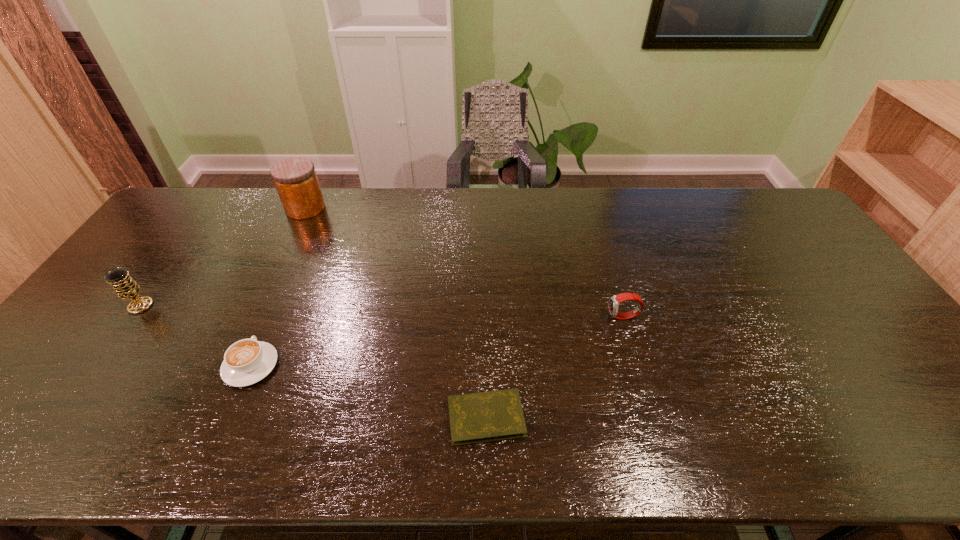
This screenshot has width=960, height=540. Identify the location of free space located on the right of the jar. (432, 208).

Locate an element on the screen. free region located on the right of the leftmost object is located at coordinates (283, 306).

Find the location of a particular element. vacant area located on the face of the third tallest object is located at coordinates (579, 317).

The width and height of the screenshot is (960, 540). Identify the location of free space located on the face of the third tallest object. [528, 317].

Find the location of `vacant space situated on the face of the third tallest object`. vacant space situated on the face of the third tallest object is located at coordinates (481, 317).

Image resolution: width=960 pixels, height=540 pixels. Identify the location of vacant space located 0.140m on the side of the second nearest object with the handle. (277, 304).

I want to click on vacant space located 0.280m on the side of the second nearest object with the handle, so click(x=293, y=269).

You are a GUI agent. You are given a task and a screenshot of the screen. Output one action in this format:
    pyautogui.click(x=<x>, y=<y>)
    Task: Click on the free location located on the side of the second nearest object with the handle
    The height and width of the screenshot is (540, 960).
    Given the screenshot: What is the action you would take?
    pyautogui.click(x=277, y=304)

I want to click on vacant space located on the left of the second object from right to left, so click(372, 417).

I want to click on object located in the far edge section of the desktop, so click(295, 179).